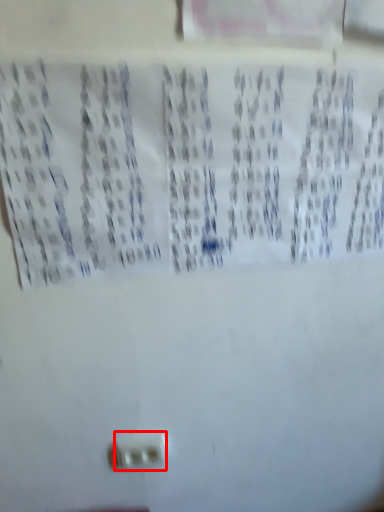
Question: Considering the relative positions of power plugs and sockets (annotated by the red box) and print in the image provided, where is power plugs and sockets (annotated by the red box) located with respect to the staircase?

Choices:
 (A) right
 (B) left

Answer: (B)